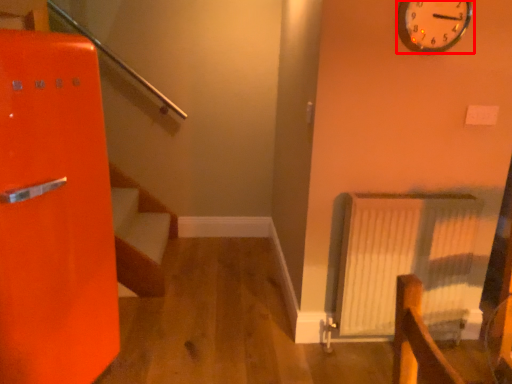
Question: Observing the image, what is the correct spatial positioning of wall clock (annotated by the red box) in reference to radiator?

Choices:
 (A) left
 (B) right

Answer: (B)